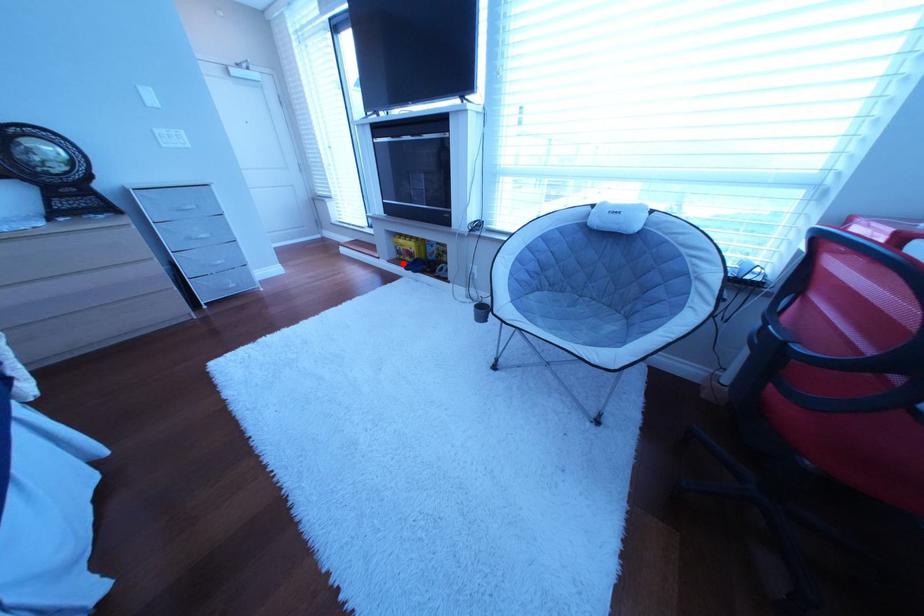
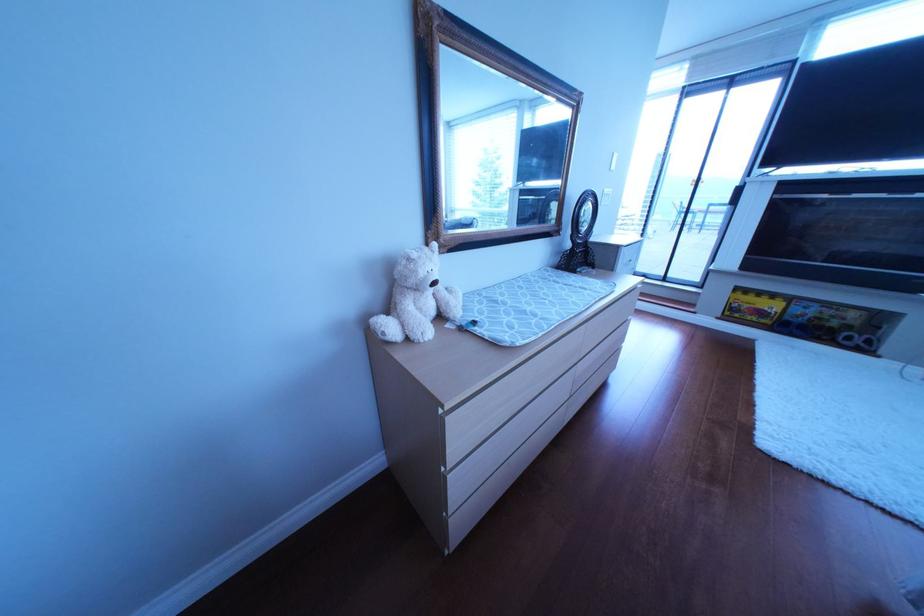
Where in the second image is the point corresponding to the highlighted location from the first image?

(733, 320)